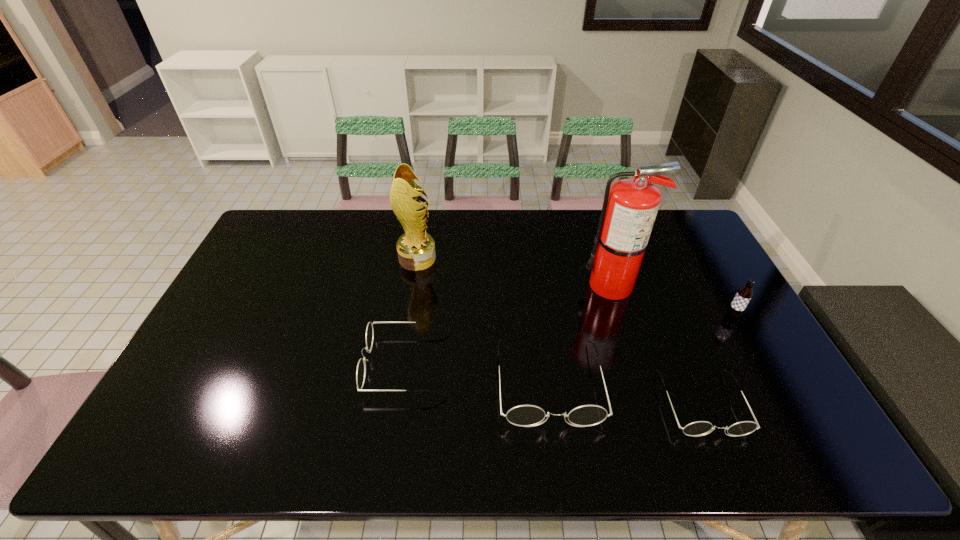
Identify the location of free space between the third object from left to right and the root beer. (640, 349).

The image size is (960, 540). I want to click on vacant region between the second spectacles from right to left and the shortest object, so click(625, 393).

What are the coordinates of `free area in between the award and the tallest object` in the screenshot? It's located at (515, 272).

Where is `vacant region between the leftmost spectacles and the shortest spectacles`? Image resolution: width=960 pixels, height=540 pixels. vacant region between the leftmost spectacles and the shortest spectacles is located at coordinates (554, 383).

What are the coordinates of `free spot between the tallest object and the shortest spectacles` in the screenshot? It's located at (657, 345).

Locate which object ranks third in proximity to the fifth shortest object. Please provide its 2D coordinates. Your answer should be formatted as a tuple, i.e. [(x, y)], where the tuple contains the x and y coordinates of a point satisfying the conditions above.

[(630, 206)]

Identify the location of object that can be found as the fourth closest to the fourth shortest object. (361, 367).

Image resolution: width=960 pixels, height=540 pixels. Find the location of `the second closest spectacles to the shortest spectacles`. the second closest spectacles to the shortest spectacles is located at coordinates (361, 367).

Locate an element on the screen. spectacles that stands as the closest to the shortest object is located at coordinates (524, 415).

You are a GUI agent. You are given a task and a screenshot of the screen. Output one action in this format:
    pyautogui.click(x=<x>, y=<y>)
    Task: Click on the vacant area in the image that satisfies the following two spatial constraints: 1. on the front side of the rightmost object; 2. on the front-facing side of the second shortest object
    
    Given the screenshot: What is the action you would take?
    pyautogui.click(x=759, y=364)